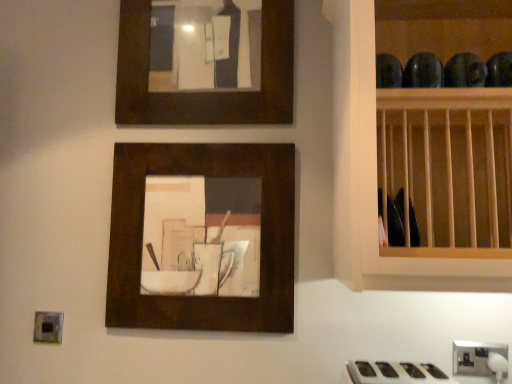
What is the approximate height of matte wood picture frame at center, arranged as the 2th picture frame when viewed from the top?

matte wood picture frame at center, arranged as the 2th picture frame when viewed from the top, is 22.28 inches in height.

Describe the element at coordinates (205, 91) in the screenshot. I see `matte brown picture frame at upper center, which ranks as the second picture frame in bottom-to-top order` at that location.

Identify the location of white glossy gas stove at lower right. The image size is (512, 384). (395, 373).

Could you tell me if matte wood picture frame at center, arranged as the 2th picture frame when viewed from the top, is facing white glossy gas stove at lower right?

No, matte wood picture frame at center, arranged as the 2th picture frame when viewed from the top, is not turned towards white glossy gas stove at lower right.

Consider the image. Does matte wood picture frame at center, arranged as the 2th picture frame when viewed from the top, have a greater width compared to white glossy gas stove at lower right?

No.

From a real-world perspective, between matte wood picture frame at center, arranged as the 2th picture frame when viewed from the top, and white glossy gas stove at lower right, who is vertically higher?

matte wood picture frame at center, arranged as the 2th picture frame when viewed from the top, from a real-world perspective.

Where is `gas stove below the matte wood picture frame at center, which is counted as the 1th picture frame, starting from the bottom (from a real-world perspective)`? The image size is (512, 384). gas stove below the matte wood picture frame at center, which is counted as the 1th picture frame, starting from the bottom (from a real-world perspective) is located at coordinates (395, 373).

Based on the photo, is satin silver outlet at lower right not inside white glossy gas stove at lower right?

Indeed, satin silver outlet at lower right is completely outside white glossy gas stove at lower right.

Is satin silver outlet at lower right far from white glossy gas stove at lower right?

No, there isn't a large distance between satin silver outlet at lower right and white glossy gas stove at lower right.

Does satin silver outlet at lower right appear on the left side of white glossy gas stove at lower right?

No, satin silver outlet at lower right is not to the left of white glossy gas stove at lower right.

Can you tell me how much satin silver outlet at lower right and white glossy gas stove at lower right differ in facing direction?

The angular difference between satin silver outlet at lower right and white glossy gas stove at lower right is 3.51 degrees.

Are satin silver outlet at lower right and matte wood picture frame at center, which is counted as the 1th picture frame, starting from the bottom, far apart?

That's not correct — satin silver outlet at lower right is a little close to matte wood picture frame at center, which is counted as the 1th picture frame, starting from the bottom.

Image resolution: width=512 pixels, height=384 pixels. I want to click on picture frame that is the 1st object above the satin silver outlet at lower right (from a real-world perspective), so click(x=202, y=297).

Visually, is satin silver outlet at lower right positioned to the left or to the right of matte wood picture frame at center, arranged as the 2th picture frame when viewed from the top?

Clearly, satin silver outlet at lower right is on the right of matte wood picture frame at center, arranged as the 2th picture frame when viewed from the top, in the image.

Can you tell me how much satin silver outlet at lower right and matte brown picture frame at upper center, which ranks as the second picture frame in bottom-to-top order, differ in facing direction?

satin silver outlet at lower right and matte brown picture frame at upper center, which ranks as the second picture frame in bottom-to-top order, are facing 2.78 degrees away from each other.

Locate an element on the screen. This screenshot has width=512, height=384. electric outlet located underneath the matte brown picture frame at upper center, which ranks as the second picture frame in bottom-to-top order (from a real-world perspective) is located at coordinates (477, 358).

Does point (484, 371) appear closer or farther from the camera than point (137, 19)?

Clearly, point (484, 371) is closer to the camera than point (137, 19).

Is satin silver outlet at lower right bigger than matte brown picture frame at upper center, which ranks as the second picture frame in bottom-to-top order?

Actually, satin silver outlet at lower right might be smaller than matte brown picture frame at upper center, which ranks as the second picture frame in bottom-to-top order.

Are matte brown picture frame at upper center, the 1th picture frame from the top, and satin silver outlet at lower right located far from each other?

Indeed, matte brown picture frame at upper center, the 1th picture frame from the top, is not near satin silver outlet at lower right.

Is satin silver outlet at lower right surrounded by matte brown picture frame at upper center, the 1th picture frame from the top?

Actually, satin silver outlet at lower right is outside matte brown picture frame at upper center, the 1th picture frame from the top.

Is matte brown picture frame at upper center, which ranks as the second picture frame in bottom-to-top order, bigger than satin silver outlet at lower right?

Correct, matte brown picture frame at upper center, which ranks as the second picture frame in bottom-to-top order, is larger in size than satin silver outlet at lower right.

From the image's perspective, which is above, white glossy gas stove at lower right or matte brown picture frame at upper center, which ranks as the second picture frame in bottom-to-top order?

matte brown picture frame at upper center, which ranks as the second picture frame in bottom-to-top order, appears higher in the image.

Could you tell me if white glossy gas stove at lower right is turned towards matte brown picture frame at upper center, the 1th picture frame from the top?

No.

Considering the positions of objects matte wood picture frame at center, which is counted as the 1th picture frame, starting from the bottom, and satin silver outlet at lower right in the image provided, who is more to the right, matte wood picture frame at center, which is counted as the 1th picture frame, starting from the bottom, or satin silver outlet at lower right?

From the viewer's perspective, satin silver outlet at lower right appears more on the right side.

Is point (274, 187) more distant than point (462, 371)?

Yes, point (274, 187) is behind point (462, 371).

Would you say satin silver outlet at lower right is part of matte wood picture frame at center, which is counted as the 1th picture frame, starting from the bottom,'s contents?

No, satin silver outlet at lower right is not surrounded by matte wood picture frame at center, which is counted as the 1th picture frame, starting from the bottom.

From the image's perspective, is matte wood picture frame at center, which is counted as the 1th picture frame, starting from the bottom, above or below satin silver outlet at lower right?

matte wood picture frame at center, which is counted as the 1th picture frame, starting from the bottom, is situated higher than satin silver outlet at lower right in the image.

Locate an element on the screen. the 1st picture frame directly above the white glossy gas stove at lower right (from a real-world perspective) is located at coordinates (202, 297).

Where is `gas stove beneath the satin silver outlet at lower right (from a real-world perspective)`? gas stove beneath the satin silver outlet at lower right (from a real-world perspective) is located at coordinates (395, 373).

Based on their spatial positions, is matte wood picture frame at center, arranged as the 2th picture frame when viewed from the top, or matte brown picture frame at upper center, the 1th picture frame from the top, further from white glossy gas stove at lower right?

matte brown picture frame at upper center, the 1th picture frame from the top, is positioned further to the anchor white glossy gas stove at lower right.

When comparing their distances from satin silver outlet at lower right, does white glossy gas stove at lower right or matte wood picture frame at center, which is counted as the 1th picture frame, starting from the bottom, seem closer?

white glossy gas stove at lower right.

From the picture: When comparing their distances from satin silver outlet at lower right, does matte wood picture frame at center, which is counted as the 1th picture frame, starting from the bottom, or matte brown picture frame at upper center, the 1th picture frame from the top, seem further?

matte brown picture frame at upper center, the 1th picture frame from the top.

When comparing their distances from matte wood picture frame at center, arranged as the 2th picture frame when viewed from the top, does white glossy gas stove at lower right or satin silver outlet at lower right seem further?

satin silver outlet at lower right is further to matte wood picture frame at center, arranged as the 2th picture frame when viewed from the top.

When comparing their distances from matte brown picture frame at upper center, which ranks as the second picture frame in bottom-to-top order, does matte wood picture frame at center, arranged as the 2th picture frame when viewed from the top, or satin silver outlet at lower right seem further?

satin silver outlet at lower right is further to matte brown picture frame at upper center, which ranks as the second picture frame in bottom-to-top order.

Based on their spatial positions, is satin silver outlet at lower right or white glossy gas stove at lower right further from matte wood picture frame at center, which is counted as the 1th picture frame, starting from the bottom?

The object further to matte wood picture frame at center, which is counted as the 1th picture frame, starting from the bottom, is satin silver outlet at lower right.

Which object lies nearer to the anchor point matte wood picture frame at center, which is counted as the 1th picture frame, starting from the bottom, matte brown picture frame at upper center, the 1th picture frame from the top, or white glossy gas stove at lower right?

matte brown picture frame at upper center, the 1th picture frame from the top, lies closer to matte wood picture frame at center, which is counted as the 1th picture frame, starting from the bottom, than the other object.

Based on their spatial positions, is matte wood picture frame at center, which is counted as the 1th picture frame, starting from the bottom, or white glossy gas stove at lower right closer to satin silver outlet at lower right?

white glossy gas stove at lower right lies closer to satin silver outlet at lower right than the other object.

Find the location of `electric outlet between matte brown picture frame at upper center, which ranks as the second picture frame in bottom-to-top order, and white glossy gas stove at lower right in the up-down direction`. electric outlet between matte brown picture frame at upper center, which ranks as the second picture frame in bottom-to-top order, and white glossy gas stove at lower right in the up-down direction is located at coordinates (477, 358).

I want to click on picture frame that lies between matte brown picture frame at upper center, which ranks as the second picture frame in bottom-to-top order, and white glossy gas stove at lower right from top to bottom, so click(202, 297).

You are a GUI agent. You are given a task and a screenshot of the screen. Output one action in this format:
    pyautogui.click(x=<x>, y=<y>)
    Task: Click on the picture frame between matte wood picture frame at center, arranged as the 2th picture frame when viewed from the top, and satin silver outlet at lower right from left to right
    
    Given the screenshot: What is the action you would take?
    pyautogui.click(x=205, y=91)

Where is `gas stove between matte wood picture frame at center, arranged as the 2th picture frame when viewed from the top, and satin silver outlet at lower right, in the horizontal direction`? Image resolution: width=512 pixels, height=384 pixels. gas stove between matte wood picture frame at center, arranged as the 2th picture frame when viewed from the top, and satin silver outlet at lower right, in the horizontal direction is located at coordinates [x=395, y=373].